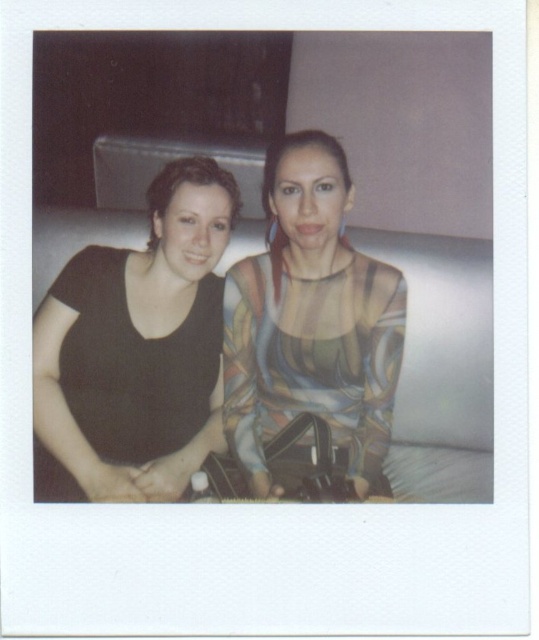
Does black matte shirt at left have a greater width compared to white fabric couch at center?

Correct, the width of black matte shirt at left exceeds that of white fabric couch at center.

What do you see at coordinates (136, 349) in the screenshot?
I see `black matte shirt at left` at bounding box center [136, 349].

What are the coordinates of `black matte shirt at left` in the screenshot? It's located at (136, 349).

Between point (36, 419) and point (227, 426), which one is positioned in front?

Positioned in front is point (36, 419).

Which is behind, point (86, 332) or point (341, 349)?

Point (86, 332)

Locate an element on the screen. black matte shirt at left is located at coordinates (136, 349).

Where is `black matte shirt at left`? This screenshot has width=539, height=640. black matte shirt at left is located at coordinates (136, 349).

Which is above, translucent multicolored top at center or white fabric couch at center?

translucent multicolored top at center is above.

Looking at this image, is translucent multicolored top at center wider than white fabric couch at center?

Indeed, translucent multicolored top at center has a greater width compared to white fabric couch at center.

Is point (375, 433) more distant than point (399, 372)?

No, (375, 433) is in front of (399, 372).

Locate an element on the screen. The height and width of the screenshot is (640, 539). translucent multicolored top at center is located at coordinates (310, 321).